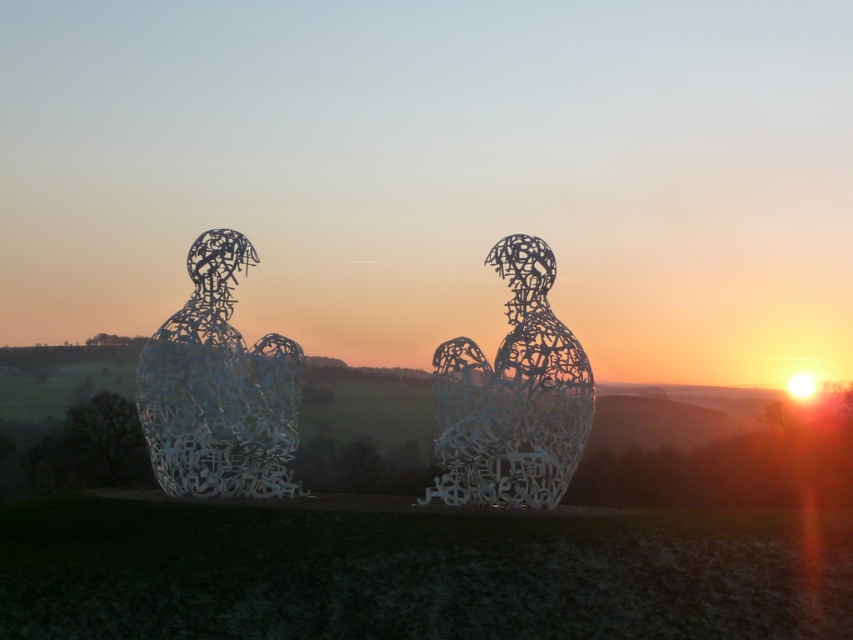
Based on the photo, you are an art curator planning to install a new sculpture that requires a minimum height of 2 meters. You observe the white wire sculpture at left and the metallic wire sculpture at center in the image. Which sculpture meets the height requirement?

The white wire sculpture at left meets the height requirement as it is taller than the metallic wire sculpture at center.

You are an art curator planning to display the white wire sculpture at left and the metallic wire sculpture at center in a gallery. Given their thickness, which sculpture would require a more stable base to prevent toppling over?

The metallic wire sculpture at center requires a more stable base because it is thicker than the white wire sculpture at left, making it potentially heavier and less balanced.